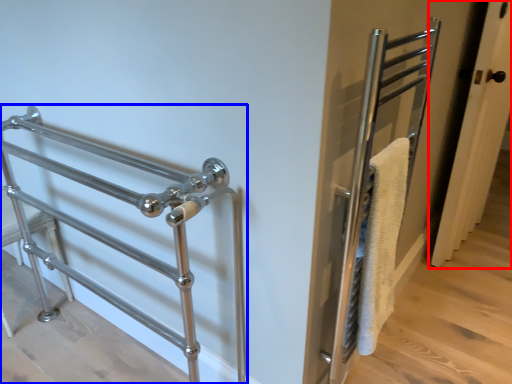
Question: Which object appears closest to the camera in this image, door (highlighted by a red box) or steel (highlighted by a blue box)?

Choices:
 (A) door
 (B) steel

Answer: (B)